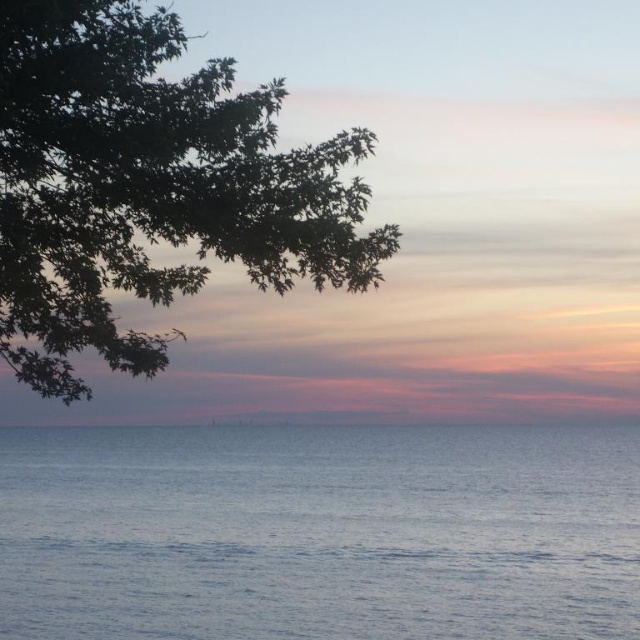
Between blue smooth water at lower center and green leafy tree at upper left, which one has more height?

Standing taller between the two is green leafy tree at upper left.

Consider the image. Can you confirm if blue smooth water at lower center is positioned to the right of green leafy tree at upper left?

Correct, you'll find blue smooth water at lower center to the right of green leafy tree at upper left.

Does point (545, 522) come farther from viewer compared to point (186, 234)?

Yes, point (545, 522) is behind point (186, 234).

I want to click on blue smooth water at lower center, so click(x=320, y=532).